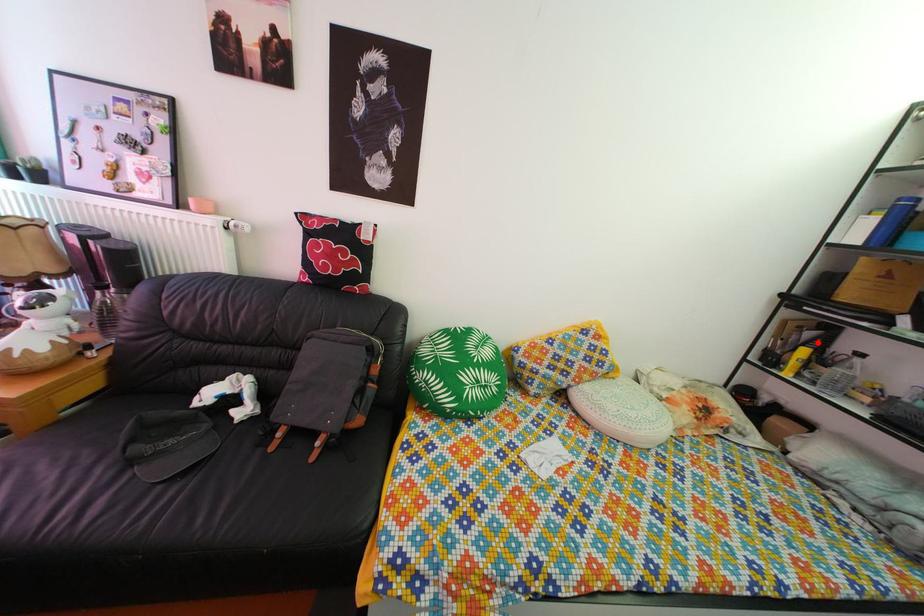
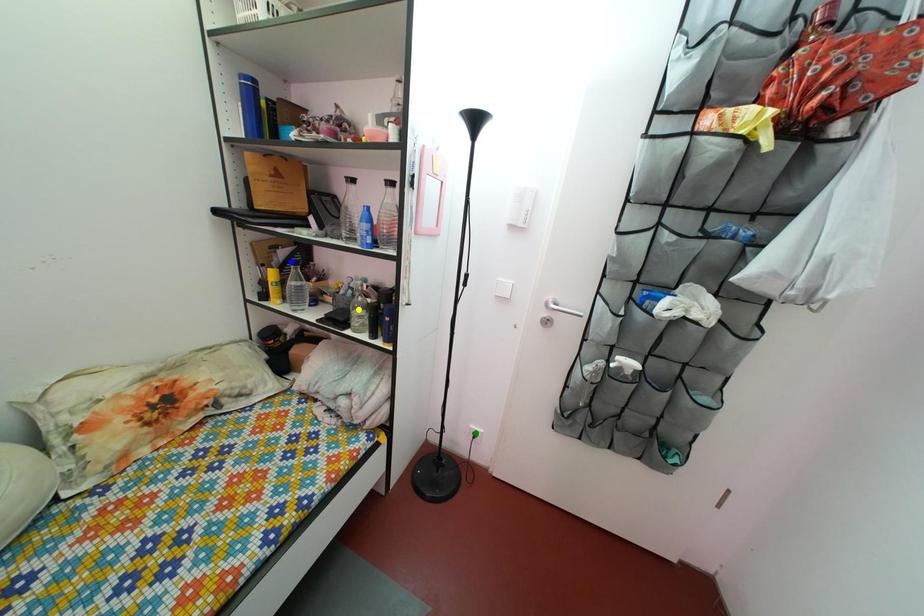
Question: I am providing you with two images of the same scene from different viewpoints. A red point is marked on the first image. You are given multiple points on the second image. Which spot in image 2 lines up with the point in image 1?

Choices:
 (A) blue point
 (B) yellow point
 (C) green point

Answer: (A)